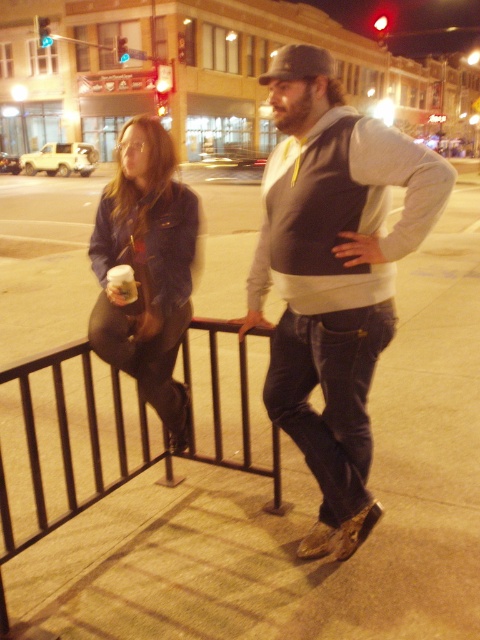
Who is more forward, (444, 433) or (154, 388)?

Positioned in front is point (154, 388).

Between brown concrete pavement at center and denim jacket at left, which one appears on the right side from the viewer's perspective?

brown concrete pavement at center is more to the right.

What do you see at coordinates (300, 506) in the screenshot? I see `brown concrete pavement at center` at bounding box center [300, 506].

At what (x,y) coordinates should I click in order to perform the action: click on brown concrete pavement at center. Please return your answer as a coordinate pair (x, y). Looking at the image, I should click on (300, 506).

Describe the element at coordinates (300, 506) in the screenshot. I see `brown concrete pavement at center` at that location.

Between brown concrete pavement at center and black metal railing at lower left, which one has more height?

brown concrete pavement at center is taller.

Which is behind, point (207, 182) or point (57, 440)?

The point (207, 182) is behind.

This screenshot has height=640, width=480. What are the coordinates of `brown concrete pavement at center` in the screenshot? It's located at (300, 506).

Who is more distant from viewer, (432, 225) or (137, 268)?

The point (137, 268) is behind.

Is point (282, 234) positioned behind point (191, 244)?

No.

What do you see at coordinates (334, 275) in the screenshot? I see `gray hoodie at center` at bounding box center [334, 275].

The height and width of the screenshot is (640, 480). In order to click on gray hoodie at center in this screenshot , I will do `click(334, 275)`.